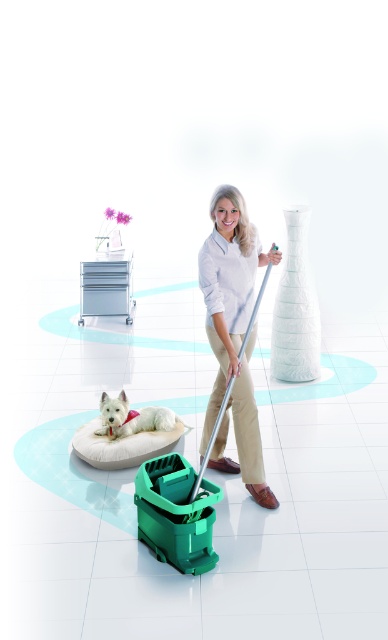
Consider the image. You are a cleaning robot and you see a point at coordinates (233, 333) in the image. What object is this point located on?

The point at coordinates (233, 333) is located on the white matte shirt at center.

You are a cleaning robot in the room. You need to determine if you can fit through the space between the white matte shirt at center and the white fabric dog bed at lower left. Your height is 1.5 meters. Can you pass through?

The white matte shirt at center is much taller than the white fabric dog bed at lower left. Since the robot is 1.5 meters tall, it may not be able to pass under the white matte shirt at center if the space between them is too low. However, without specific height measurements, it is uncertain.

You are a cleaning robot that is 1.5 feet wide. You are positioned at the entrance of the room and need to move to the white matte shirt at center. There is an obstacle 13.83 feet away from you. Can you navigate around it without colliding?

The obstacle is 13.83 feet away from the white matte shirt at center. Since the robot is 1.5 feet wide, it can navigate around the obstacle as long as there is sufficient space. However, the description only specifies the distance between them, not the available clearance, so it is uncertain if the robot can safely pass without more information about the path.